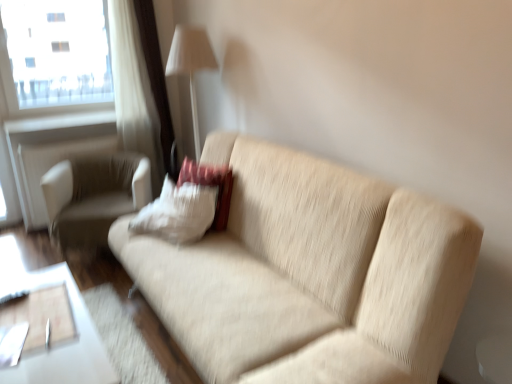
Where is `free space above white glossy table at lower left (from a real-world perspective)`? free space above white glossy table at lower left (from a real-world perspective) is located at coordinates (39, 332).